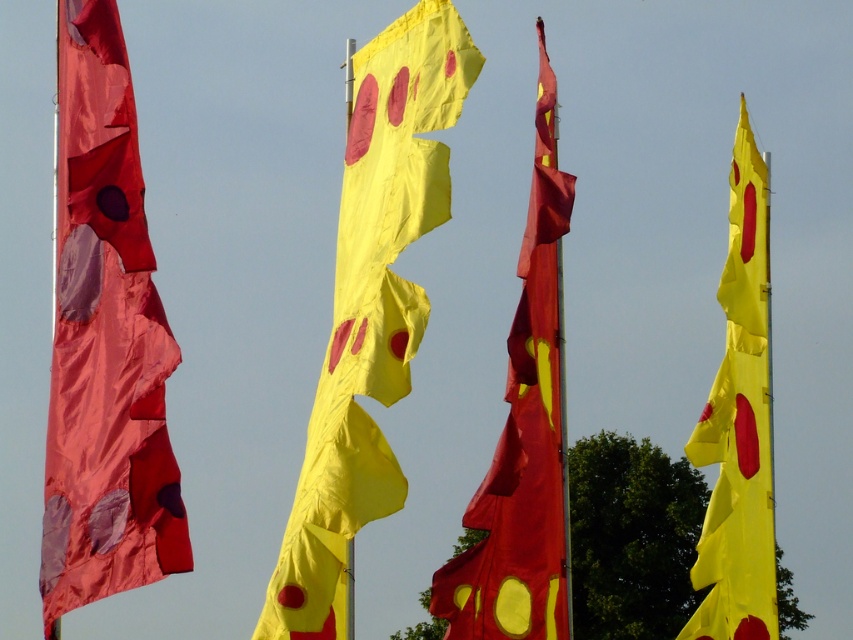
You are standing in front of the flags and want to know which of the two points, point (x=184, y=544) or point (x=711, y=552), is closer to you. Based on their positions, which point is nearer?

Point (x=184, y=544) is in front of point (x=711, y=552), so it is closer to you.

You are a flag designer observing the flags in the scene. Which of the two yellow flags, the yellow matte fabric flag at center or the yellow fabric flag at right, has a greater surface area?

The yellow matte fabric flag at center has a greater surface area than the yellow fabric flag at right because it is larger in size.